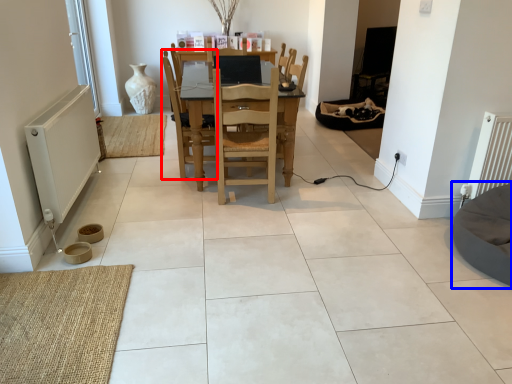
Question: Which object appears closest to the camera in this image, chair (highlighted by a red box) or bean bag chair (highlighted by a blue box)?

Choices:
 (A) chair
 (B) bean bag chair

Answer: (B)